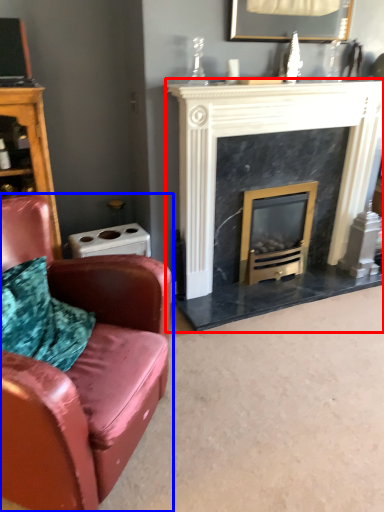
Question: Which object appears farthest to the camera in this image, fireplace (highlighted by a red box) or chair (highlighted by a blue box)?

Choices:
 (A) fireplace
 (B) chair

Answer: (A)